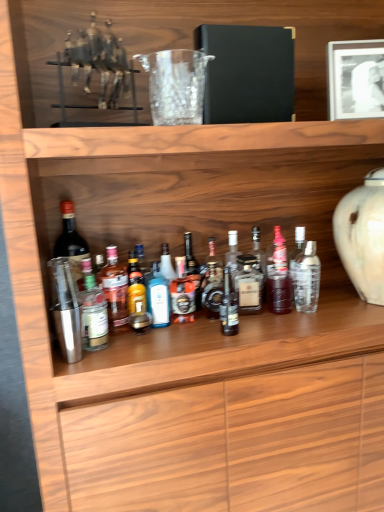
Question: Which is correct: translucent glass bottle at center, which ranks as the 3th bottle in right-to-left order, is inside translucent glass bottle at center, the fifth bottle when ordered from left to right, or outside of it?

Choices:
 (A) outside
 (B) inside

Answer: (A)

Question: Is translucent glass bottle at center, acting as the eleventh bottle starting from the left, bigger or smaller than translucent glass bottle at center, which appears as the 9th bottle when viewed from the right?

Choices:
 (A) small
 (B) big

Answer: (B)

Question: Which of these objects is positioned closest to the translucent glass bottle at center, the 6th bottle when ordered from left to right?

Choices:
 (A) translucent glass bottle at center, which ranks as the 3th bottle in right-to-left order
 (B) transparent glass at center
 (C) black glass bottle at center, acting as the 7th bottle starting from the right
 (D) white matte picture frame at upper right
 (E) metallic silver shaker at center-left, the 2th bottle when ordered from left to right

Answer: (C)

Question: Which of these objects is positioned closest to the black glass bottle at center, acting as the 7th bottle starting from the right?

Choices:
 (A) translucent glass bottle at center, the 10th bottle when ordered from left to right
 (B) metallic silver shaker at center-left, the 2th bottle when ordered from left to right
 (C) clear glass bottle at center, which is the 2th bottle from right to left
 (D) transparent glass at center
 (E) metallic silver horse at upper left

Answer: (A)